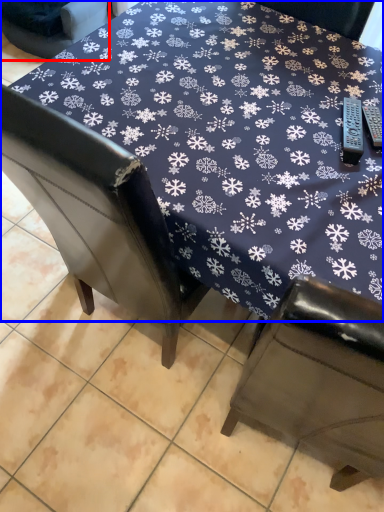
Question: Which object is closer to the camera taking this photo, chair (highlighted by a red box) or table (highlighted by a blue box)?

Choices:
 (A) chair
 (B) table

Answer: (B)